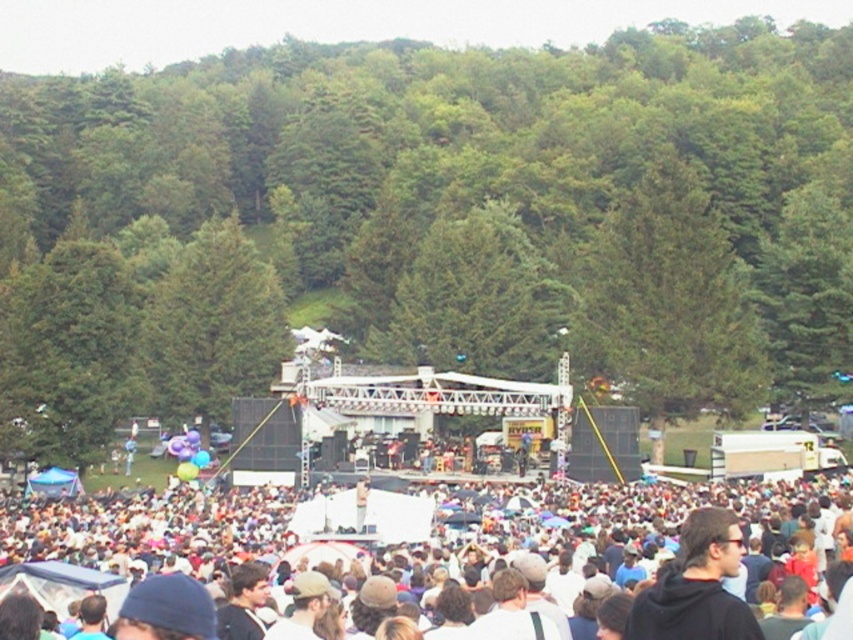
Question: Is white cotton crowd at center wider than black hoodie at center?

Choices:
 (A) no
 (B) yes

Answer: (B)

Question: Which point appears farthest from the camera in this image?

Choices:
 (A) pyautogui.click(x=746, y=604)
 (B) pyautogui.click(x=723, y=492)

Answer: (B)

Question: Is the position of white cotton crowd at center more distant than that of black hoodie at center?

Choices:
 (A) no
 (B) yes

Answer: (B)

Question: Can you confirm if white cotton crowd at center is bigger than black hoodie at center?

Choices:
 (A) no
 (B) yes

Answer: (B)